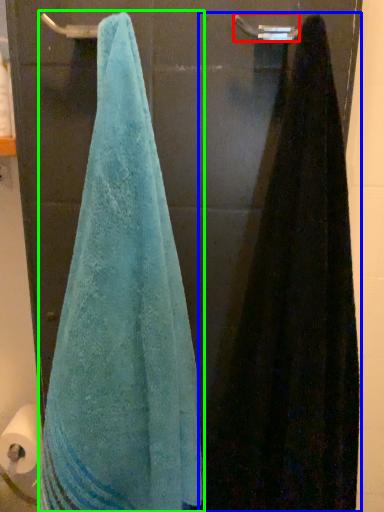
Question: Considering the real-world distances, which object is farthest from towel bar (highlighted by a red box)? towel (highlighted by a blue box) or towel (highlighted by a green box)?

Choices:
 (A) towel
 (B) towel

Answer: (B)